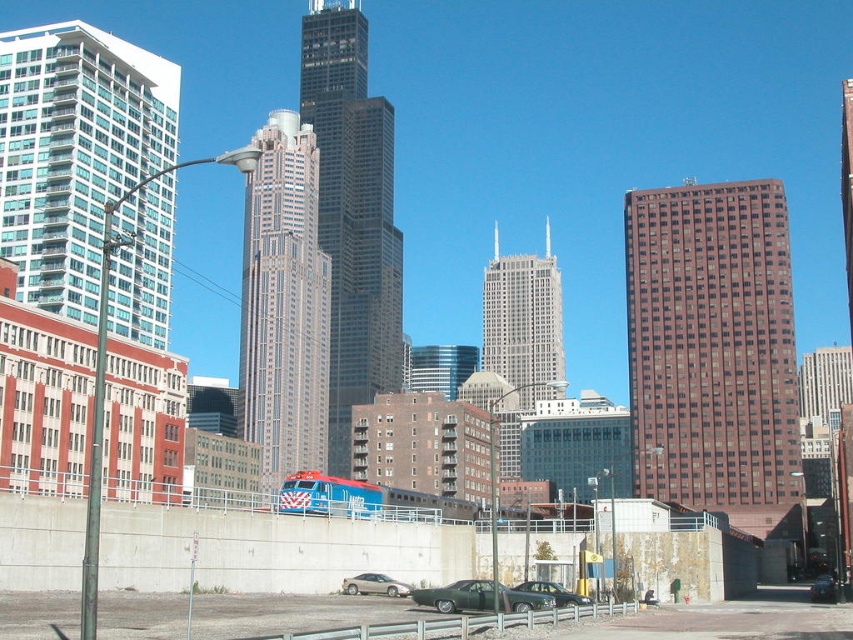
Is glassy teal skyscraper at upper left above shiny black sedan at center?

Indeed, glassy teal skyscraper at upper left is positioned over shiny black sedan at center.

Is point (84, 259) in front of point (817, 600)?

No, (84, 259) is further to viewer.

You are a GUI agent. You are given a task and a screenshot of the screen. Output one action in this format:
    pyautogui.click(x=<x>, y=<y>)
    Task: Click on the glassy teal skyscraper at upper left
    Image resolution: width=853 pixels, height=640 pixels.
    Given the screenshot: What is the action you would take?
    pyautogui.click(x=74, y=150)

Which is more to the left, metallic green car at lower center or shiny black sedan at center?

From the viewer's perspective, metallic green car at lower center appears more on the left side.

Between metallic green car at lower center and shiny black sedan at center, which one appears on the right side from the viewer's perspective?

From the viewer's perspective, shiny black sedan at center appears more on the right side.

Does point (550, 582) come in front of point (817, 592)?

Yes, point (550, 582) is in front of point (817, 592).

You are a GUI agent. You are given a task and a screenshot of the screen. Output one action in this format:
    pyautogui.click(x=<x>, y=<y>)
    Task: Click on the metallic green car at lower center
    
    Given the screenshot: What is the action you would take?
    pyautogui.click(x=553, y=593)

Does glassy teal skyscraper at upper left have a smaller size compared to white glass skyscraper at center?

Correct, glassy teal skyscraper at upper left occupies less space than white glass skyscraper at center.

Does point (56, 52) come behind point (532, 317)?

No, (56, 52) is closer to viewer.

Where is `glassy teal skyscraper at upper left`? glassy teal skyscraper at upper left is located at coordinates (74, 150).

At what (x,y) coordinates should I click in order to perform the action: click on glassy teal skyscraper at upper left. Please return your answer as a coordinate pair (x, y). The image size is (853, 640). Looking at the image, I should click on (74, 150).